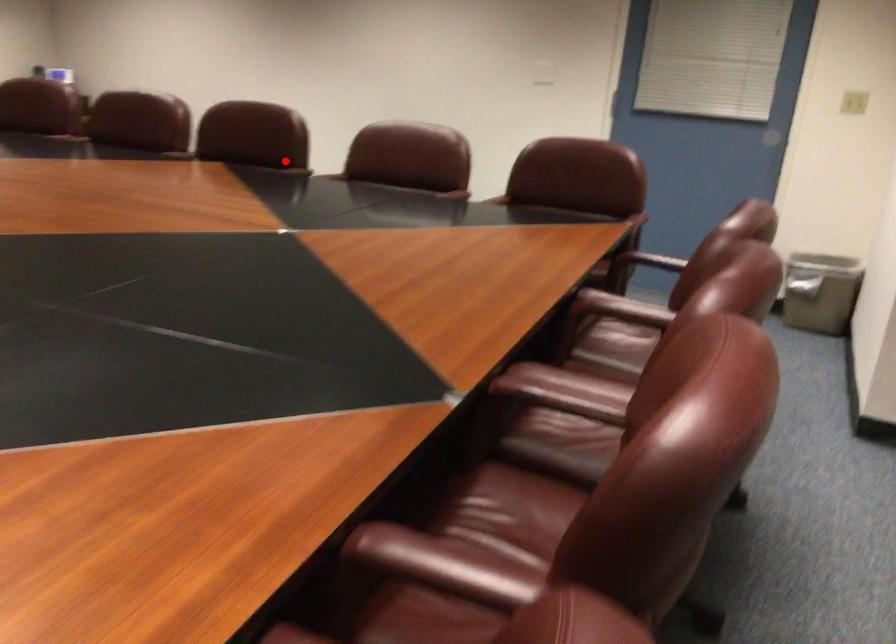
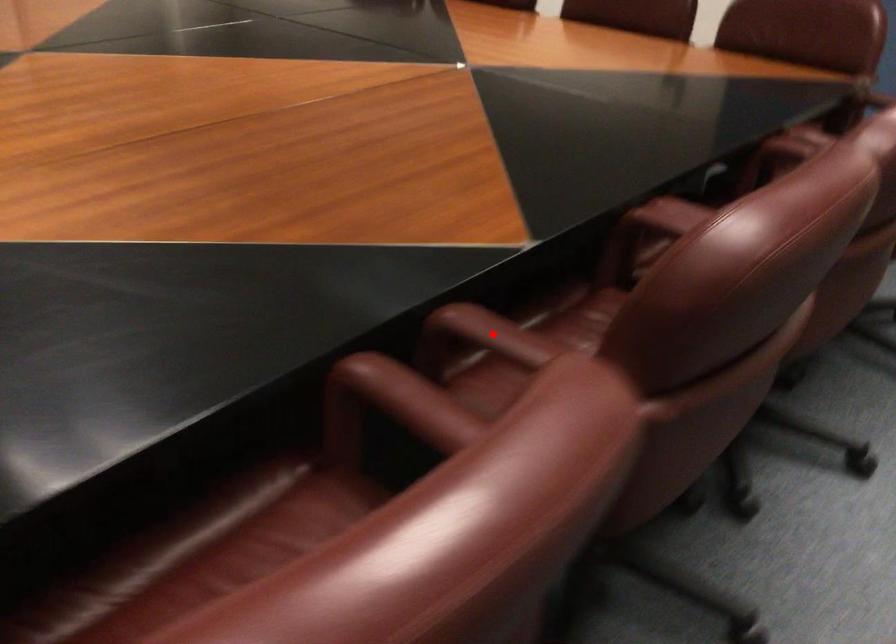
I am providing you with two images of the same scene from different viewpoints. A red point is marked on the first image and another point is marked on the second image. Is the marked point in image1 the same physical position as the marked point in image2?

Yes